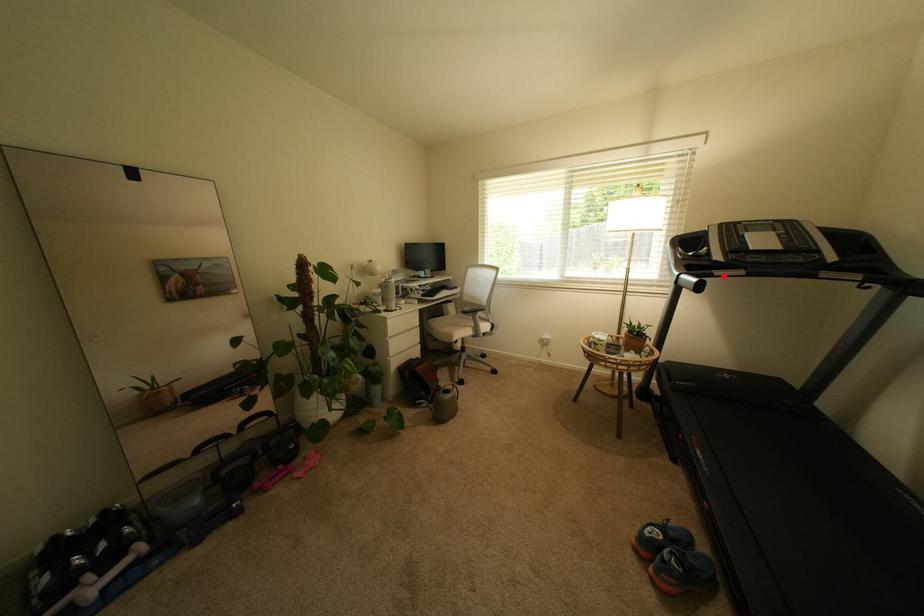
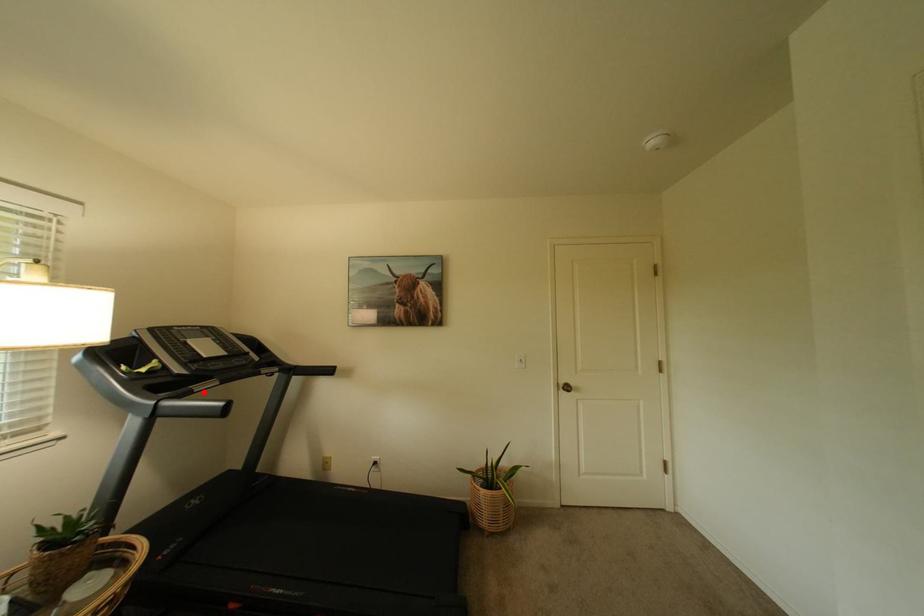
I am providing you with two images of the same scene from different viewpoints. A red point is marked on the first image and another point is marked on the second image. Is the red point in image1 aligned with the point shown in image2?

Yes